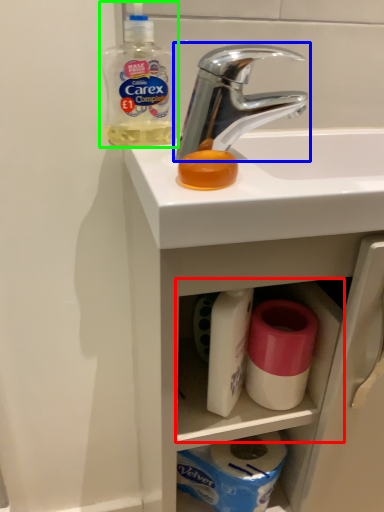
Question: Which object is positioned farthest from cabinet (highlighted by a red box)? Select from tap (highlighted by a blue box) and cleaning product (highlighted by a green box).

Choices:
 (A) tap
 (B) cleaning product

Answer: (B)